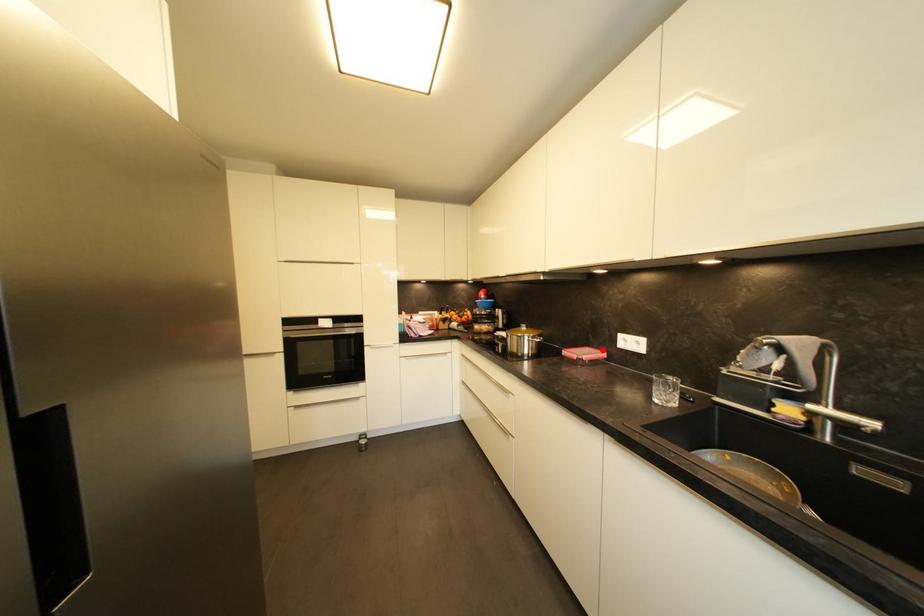
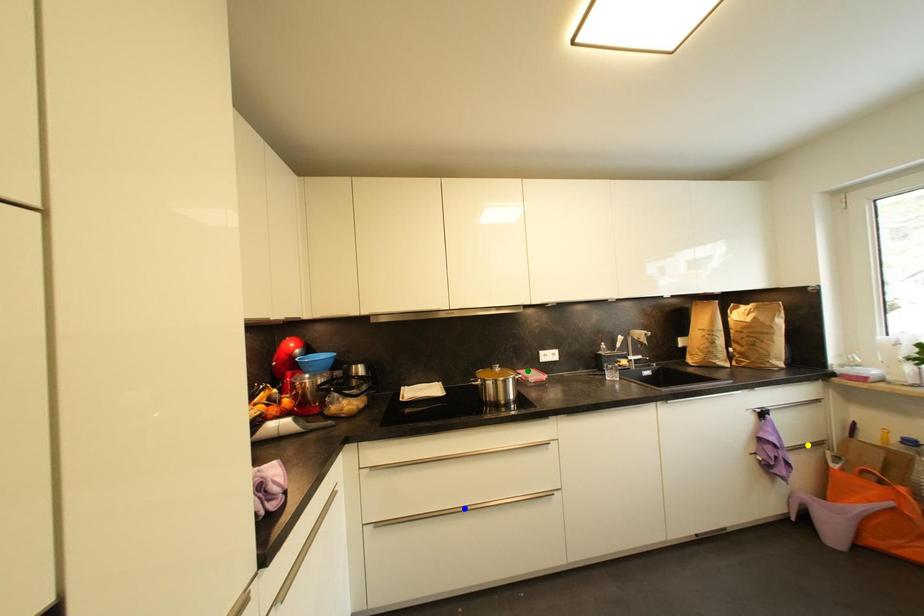
Question: I am providing you with two images of the same scene from different viewpoints. A red point is marked on the first image. You are given multiple points on the second image. Can you choose the point in image 2 that corresponds to the point in image 1?

Choices:
 (A) yellow point
 (B) green point
 (C) blue point

Answer: (B)